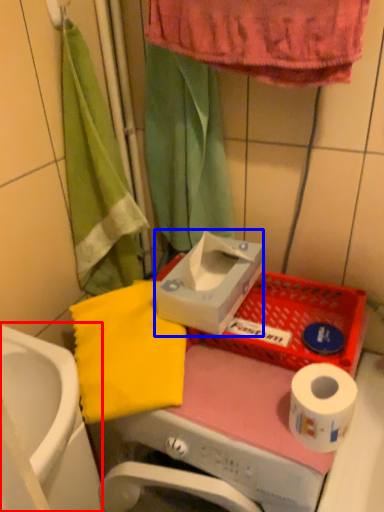
Question: Among these objects, which one is nearest to the camera, sink (highlighted by a red box) or carton (highlighted by a blue box)?

Choices:
 (A) sink
 (B) carton

Answer: (A)